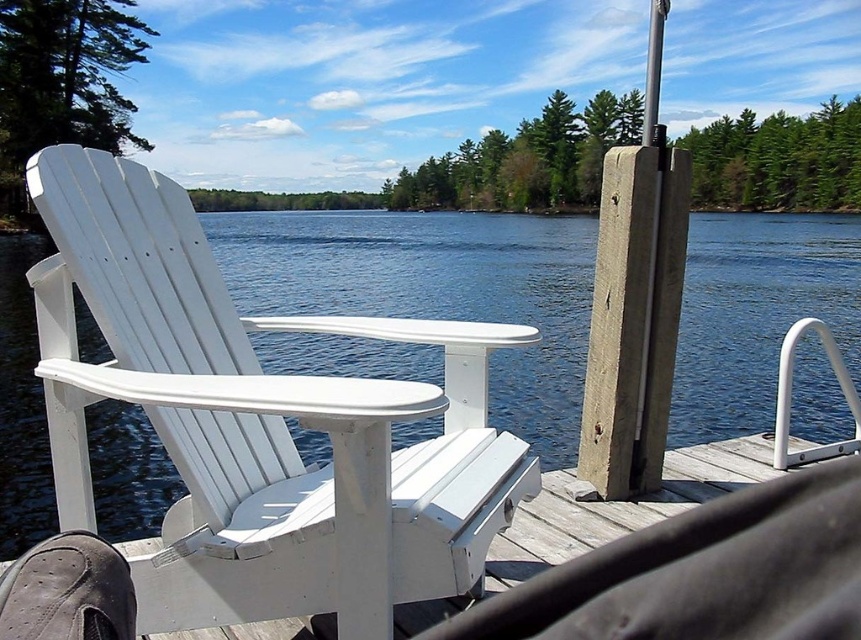
You are standing on the wooden dock and want to sit down on the white wood beach chair at left. To reach it, you must pass between the chair and the smooth gray pole at right. Is there enough space to walk through comfortably?

The white wood beach chair at left is to the left of the smooth gray pole at right, so there is space between them for you to walk through comfortably.

You are standing at the edge of the lake and see two points in the water. The first point is at coordinates point (165, 248) and the second is at point (705, 458). Which point is closer to you?

Point (165, 248) is in front of point (705, 458), so the first point is closer to you.